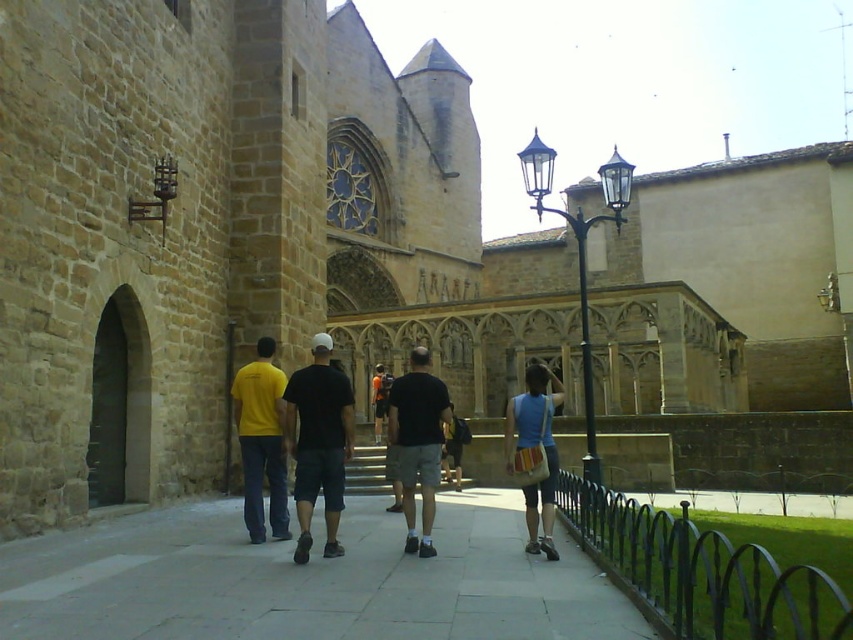
Is yellow t-shirt at center below black cotton t-shirt at center?

No.

Find the location of `yellow t-shirt at center`. yellow t-shirt at center is located at coordinates (260, 442).

This screenshot has height=640, width=853. In order to click on yellow t-shirt at center in this screenshot , I will do `click(260, 442)`.

I want to click on yellow t-shirt at center, so click(x=260, y=442).

Is black cotton shorts at center bigger than yellow t-shirt at center?

Indeed, black cotton shorts at center has a larger size compared to yellow t-shirt at center.

How much distance is there between black cotton shorts at center and yellow t-shirt at center?

black cotton shorts at center and yellow t-shirt at center are 2.04 meters apart from each other.

What do you see at coordinates (318, 442) in the screenshot? This screenshot has width=853, height=640. I see `black cotton shorts at center` at bounding box center [318, 442].

Locate an element on the screen. This screenshot has width=853, height=640. black cotton shorts at center is located at coordinates (318, 442).

Between black cotton t-shirt at center and blue cotton tank top at center, which one has more height?

With more height is black cotton t-shirt at center.

Does black cotton t-shirt at center have a larger size compared to blue cotton tank top at center?

Yes.

You are a GUI agent. You are given a task and a screenshot of the screen. Output one action in this format:
    pyautogui.click(x=<x>, y=<y>)
    Task: Click on the black cotton t-shirt at center
    The height and width of the screenshot is (640, 853).
    Given the screenshot: What is the action you would take?
    pyautogui.click(x=418, y=444)

Locate an element on the screen. This screenshot has height=640, width=853. black cotton t-shirt at center is located at coordinates (418, 444).